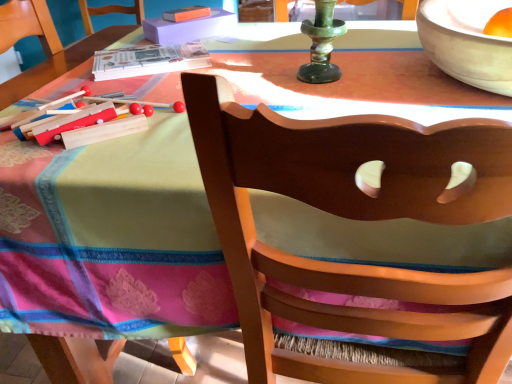
Question: Would you say wooden chair at center is inside or outside orange matte chair at upper left?

Choices:
 (A) inside
 (B) outside

Answer: (B)

Question: Considering the positions of wooden chair at center and orange matte chair at upper left in the image, is wooden chair at center wider or thinner than orange matte chair at upper left?

Choices:
 (A) wide
 (B) thin

Answer: (A)

Question: Is point (241, 158) positioned closer to the camera than point (53, 51)?

Choices:
 (A) farther
 (B) closer

Answer: (B)

Question: From a real-world perspective, relative to wooden chair at center, is orange matte chair at upper left vertically above or below?

Choices:
 (A) above
 (B) below

Answer: (A)

Question: Visually, is orange matte chair at upper left positioned to the left or to the right of wooden chair at center?

Choices:
 (A) left
 (B) right

Answer: (A)

Question: In terms of size, does orange matte chair at upper left appear bigger or smaller than wooden chair at center?

Choices:
 (A) small
 (B) big

Answer: (A)

Question: Is orange matte chair at upper left spatially inside wooden chair at center, or outside of it?

Choices:
 (A) inside
 (B) outside

Answer: (B)